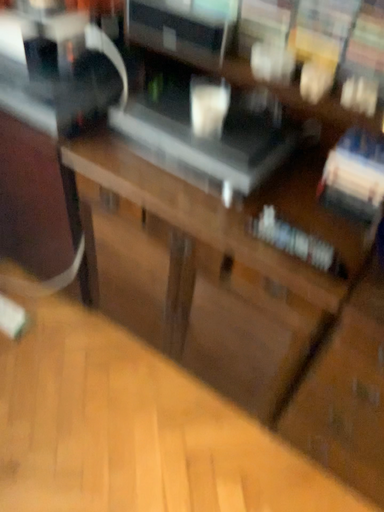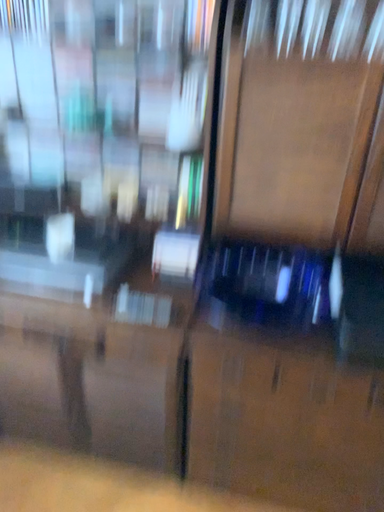
Question: How did the camera likely rotate when shooting the video?

Choices:
 (A) rotated right
 (B) rotated left

Answer: (A)